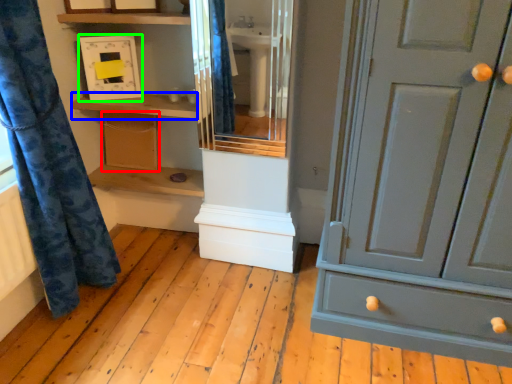
Question: Which is nearer to the cabinetry (highlighted by a red box)? shelf (highlighted by a blue box) or medicine cabinet (highlighted by a green box).

Choices:
 (A) shelf
 (B) medicine cabinet

Answer: (A)